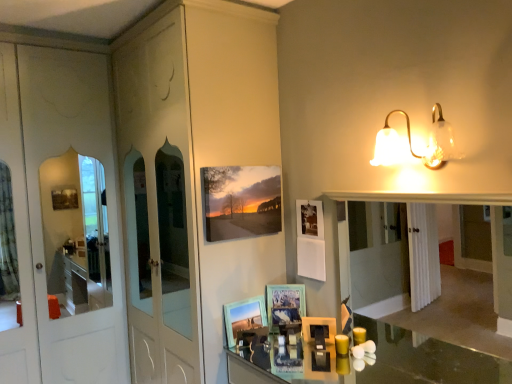
Question: From a real-world perspective, relative to wooden picture frame at center, the 2th picture frame from the top, is matte canvas print at upper center, the third picture frame ordered from the bottom, vertically above or below?

Choices:
 (A) above
 (B) below

Answer: (A)

Question: In terms of size, does matte canvas print at upper center, the third picture frame ordered from the bottom, appear bigger or smaller than wooden picture frame at center, the second picture frame when ordered from bottom to top?

Choices:
 (A) small
 (B) big

Answer: (B)

Question: Which object is positioned closest to the yellow wax candle at center?

Choices:
 (A) translucent glass sconce at upper right
 (B) wooden picture frame at center, the 2th picture frame from the top
 (C) clear glass mirror at center
 (D) matte canvas print at upper center, the third picture frame ordered from the bottom
 (E) wooden picture frame at center, which appears as the 1th picture frame when ordered from the bottom

Answer: (B)

Question: Considering the real-world distances, which object is closest to the yellow wax candle at center?

Choices:
 (A) wooden picture frame at center, the second picture frame when ordered from bottom to top
 (B) translucent glass sconce at upper right
 (C) clear glass mirror at center
 (D) matte canvas print at upper center, which is counted as the first picture frame, starting from the top
 (E) wooden picture frame at center, the third picture frame in the top-to-bottom sequence

Answer: (A)